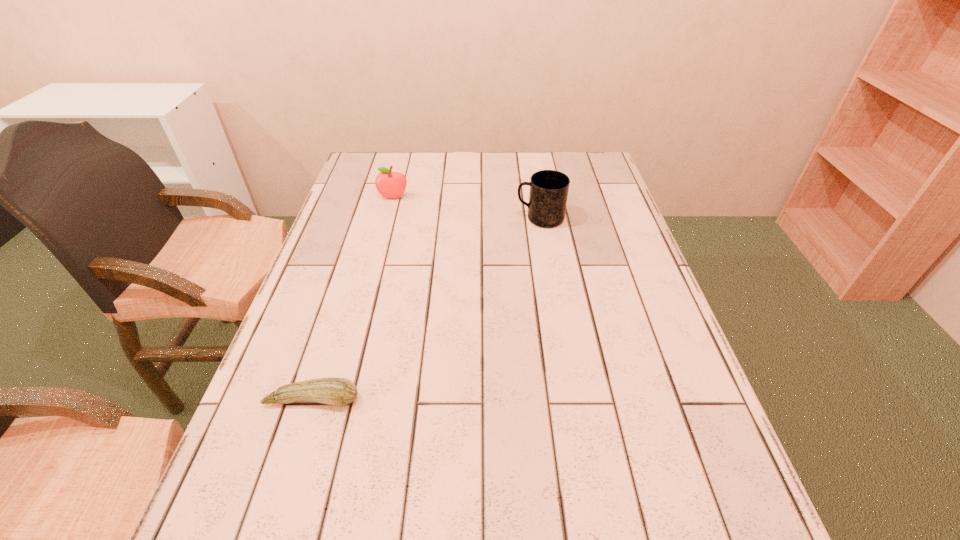
At what (x,y) coordinates should I click in order to perform the action: click on free space located at the stem end of the nearest object. Please return your answer as a coordinate pair (x, y). Image resolution: width=960 pixels, height=540 pixels. Looking at the image, I should click on (275, 521).

Where is `apple that is at the left edge`? The width and height of the screenshot is (960, 540). apple that is at the left edge is located at coordinates (389, 184).

Identify the location of zucchini positioned at the left edge. (335, 391).

Where is `vacant space at the far edge`? The image size is (960, 540). vacant space at the far edge is located at coordinates (434, 179).

Where is `blank space at the left edge of the desktop`? The width and height of the screenshot is (960, 540). blank space at the left edge of the desktop is located at coordinates [x=392, y=207].

In the image, there is a desktop. Where is `blank space at the right edge`? The height and width of the screenshot is (540, 960). blank space at the right edge is located at coordinates (596, 266).

Where is `vacant region at the far right corner`? vacant region at the far right corner is located at coordinates click(591, 186).

Where is `free space between the zucchini and the second nearest object`? The height and width of the screenshot is (540, 960). free space between the zucchini and the second nearest object is located at coordinates (426, 309).

Find the location of a particular element. Image resolution: width=960 pixels, height=540 pixels. free spot between the second nearest object and the farthest object is located at coordinates (467, 208).

Where is `blank region between the shortest object and the rightmost object`? blank region between the shortest object and the rightmost object is located at coordinates (426, 309).